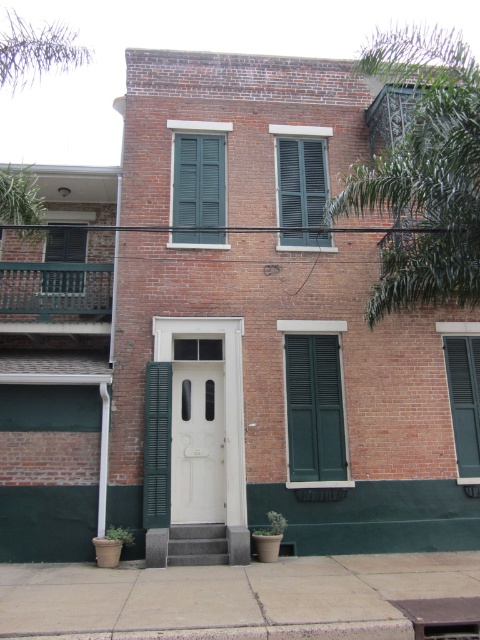
You are standing in front of the two story brick building and notice the green matte shutter at right and the green matte shutter at left. Which one is positioned closer to you?

The green matte shutter at right is closer to the viewer than the green matte shutter at left.

You are standing in front of the two story brick building. You see the green matte shutters at center and the green matte shutters at upper center. Which one is closer to you?

The green matte shutters at center are closer to the viewer than the green matte shutters at upper center.

You are standing in front of the two story brick building and want to locate the green matte shutters at center. According to their position, where would you look relative to the central white door?

The green matte shutters at center are located at point coordinates 0.294 on the x axis and 0.415 on the y axis, so you should look slightly to the left and a bit above the central white door to find them.